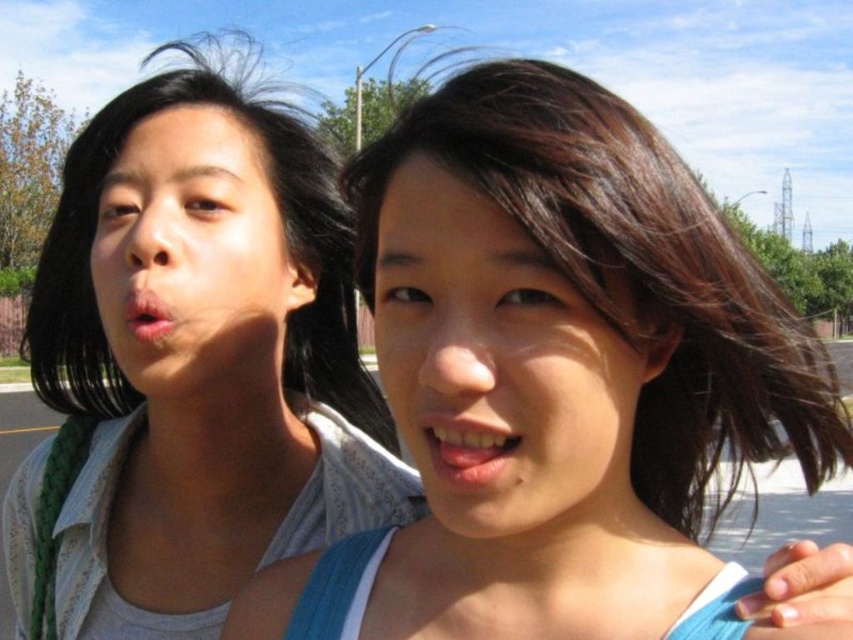
Question: Does smooth brown hair at center have a greater width compared to matte white shirt at left?

Choices:
 (A) no
 (B) yes

Answer: (A)

Question: Does smooth skin face at center have a larger size compared to smooth skin face at left?

Choices:
 (A) no
 (B) yes

Answer: (A)

Question: Does smooth brown hair at center have a lesser width compared to smooth skin face at center?

Choices:
 (A) yes
 (B) no

Answer: (B)

Question: Among these points, which one is nearest to the camera?

Choices:
 (A) (328, 259)
 (B) (476, 220)
 (C) (497, 232)
 (D) (152, 316)

Answer: (C)

Question: Which of the following is the farthest from the observer?

Choices:
 (A) (204, 435)
 (B) (515, 486)
 (C) (503, 442)
 (D) (137, 236)

Answer: (A)

Question: Which object appears farthest from the camera in this image?

Choices:
 (A) pink matte lips at center
 (B) matte white shirt at left
 (C) smooth skin face at left
 (D) smooth brown hair at center

Answer: (B)